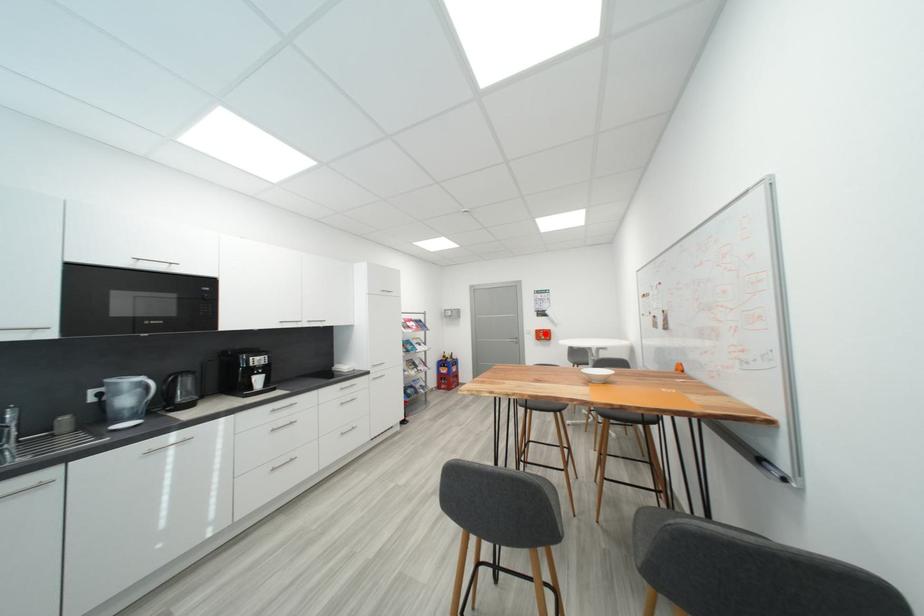
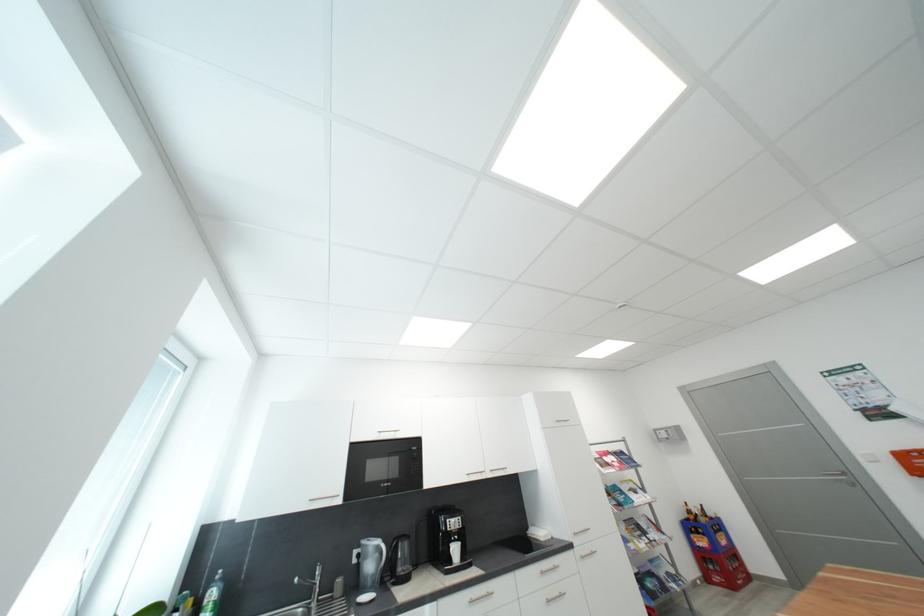
Question: I am providing you with two images of the same scene from different viewpoints. In image1, a red point is highlighted. Considering the same 3D point in image2, which of the following is correct?

Choices:
 (A) It is closer
 (B) It is farther

Answer: (A)